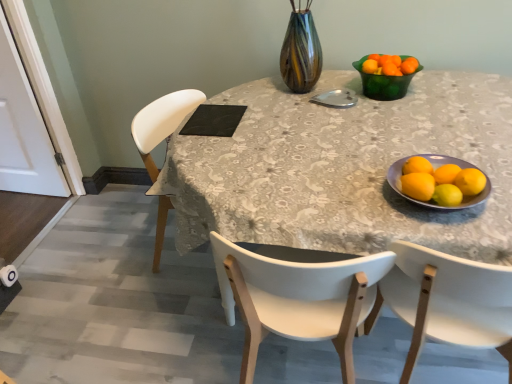
Question: Is black matte placemat at upper center oriented towards matte ceramic bowl at right?

Choices:
 (A) yes
 (B) no

Answer: (A)

Question: Is black matte placemat at upper center looking in the opposite direction of matte ceramic bowl at right?

Choices:
 (A) no
 (B) yes

Answer: (A)

Question: Is black matte placemat at upper center next to matte ceramic bowl at right?

Choices:
 (A) yes
 (B) no

Answer: (B)

Question: From a real-world perspective, is black matte placemat at upper center physically below matte ceramic bowl at right?

Choices:
 (A) yes
 (B) no

Answer: (A)

Question: Is matte ceramic bowl at right a part of black matte placemat at upper center?

Choices:
 (A) no
 (B) yes

Answer: (A)

Question: From the image's perspective, does black matte placemat at upper center appear higher than matte ceramic bowl at right?

Choices:
 (A) no
 (B) yes

Answer: (B)

Question: Is yellow matte lemon at right, acting as the first lemon starting from the right, wider than white plastic chair at right, the 1th chair in the right-to-left sequence?

Choices:
 (A) yes
 (B) no

Answer: (B)

Question: From a real-world perspective, is yellow matte lemon at right, the fourth lemon positioned from the left, positioned over white plastic chair at right, the 2th chair from the left, based on gravity?

Choices:
 (A) yes
 (B) no

Answer: (A)

Question: Is white plastic chair at right, the 2th chair from the left, at the back of yellow matte lemon at right, acting as the first lemon starting from the right?

Choices:
 (A) yes
 (B) no

Answer: (B)

Question: From a real-world perspective, is yellow matte lemon at right, acting as the first lemon starting from the right, located beneath white plastic chair at right, the 1th chair in the right-to-left sequence?

Choices:
 (A) yes
 (B) no

Answer: (B)

Question: Does yellow matte lemon at right, acting as the first lemon starting from the right, come in front of white plastic chair at right, the 2th chair from the left?

Choices:
 (A) no
 (B) yes

Answer: (A)

Question: Is yellow matte lemon at right, acting as the first lemon starting from the right, directly adjacent to white plastic chair at right, the 2th chair from the left?

Choices:
 (A) no
 (B) yes

Answer: (A)

Question: Does matte ceramic bowl at right have a smaller size compared to white wood chair at center, which is the 1th chair from left to right?

Choices:
 (A) no
 (B) yes

Answer: (B)